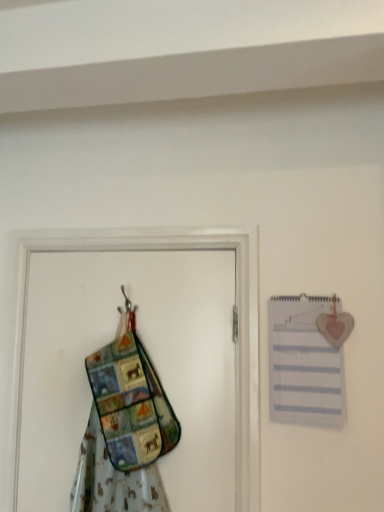
Question: Is white paper journal at upper right not within multicolored fabric screen door at left?

Choices:
 (A) no
 (B) yes

Answer: (B)

Question: Does white paper journal at upper right lie behind multicolored fabric screen door at left?

Choices:
 (A) no
 (B) yes

Answer: (A)

Question: From a real-world perspective, is white paper journal at upper right positioned under multicolored fabric screen door at left based on gravity?

Choices:
 (A) no
 (B) yes

Answer: (A)

Question: Is the depth of white paper journal at upper right less than that of multicolored fabric screen door at left?

Choices:
 (A) yes
 (B) no

Answer: (A)

Question: Is white paper journal at upper right bigger than multicolored fabric screen door at left?

Choices:
 (A) no
 (B) yes

Answer: (A)

Question: From a real-world perspective, relative to multicolored fabric apron at left, is multicolored fabric screen door at left vertically above or below?

Choices:
 (A) below
 (B) above

Answer: (B)

Question: From the image's perspective, is multicolored fabric screen door at left located above or below multicolored fabric apron at left?

Choices:
 (A) above
 (B) below

Answer: (B)

Question: Is multicolored fabric screen door at left bigger or smaller than multicolored fabric apron at left?

Choices:
 (A) small
 (B) big

Answer: (B)

Question: Is multicolored fabric screen door at left inside or outside of multicolored fabric apron at left?

Choices:
 (A) outside
 (B) inside

Answer: (A)

Question: Looking at their shapes, would you say multicolored fabric apron at left is wider or thinner than white paper journal at upper right?

Choices:
 (A) thin
 (B) wide

Answer: (B)

Question: Do you think multicolored fabric apron at left is within white paper journal at upper right, or outside of it?

Choices:
 (A) outside
 (B) inside

Answer: (A)

Question: From a real-world perspective, is multicolored fabric apron at left above or below white paper journal at upper right?

Choices:
 (A) below
 (B) above

Answer: (A)

Question: Considering their positions, is multicolored fabric apron at left located in front of or behind white paper journal at upper right?

Choices:
 (A) behind
 (B) front

Answer: (B)

Question: Is point (153, 476) closer or farther from the camera than point (147, 249)?

Choices:
 (A) farther
 (B) closer

Answer: (B)

Question: In terms of height, does multicolored fabric apron at left look taller or shorter compared to multicolored fabric screen door at left?

Choices:
 (A) short
 (B) tall

Answer: (A)